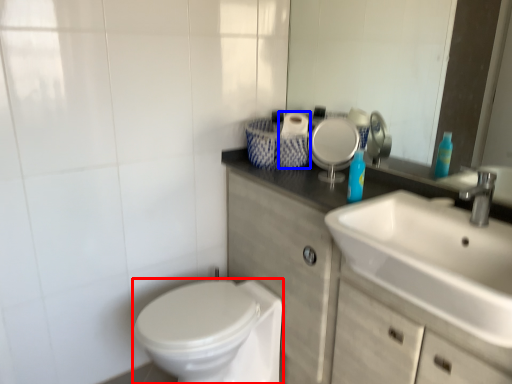
Question: Which object appears farthest to the camera in this image, bidet (highlighted by a red box) or toilet paper (highlighted by a blue box)?

Choices:
 (A) bidet
 (B) toilet paper

Answer: (B)